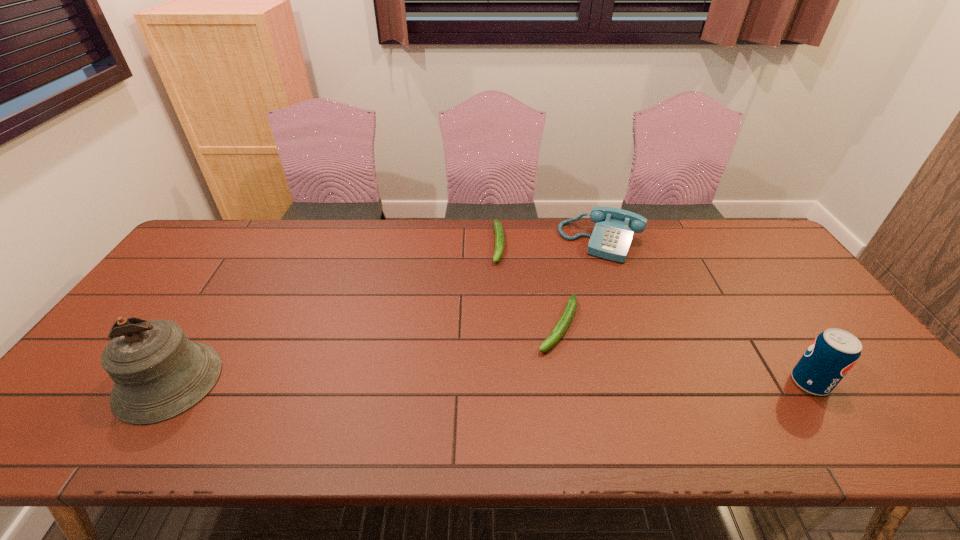
This screenshot has height=540, width=960. What are the coordinates of `vacant area that lies between the leftmost object and the telephone` in the screenshot? It's located at (385, 312).

I want to click on free space that is in between the telephone and the fourth object from right to left, so click(x=549, y=243).

Locate an element on the screen. The width and height of the screenshot is (960, 540). the third closest object to the leftmost object is located at coordinates (611, 238).

Locate which object ranks in proximity to the farther zucchini. Please provide its 2D coordinates. Your answer should be formatted as a tuple, i.e. [(x, y)], where the tuple contains the x and y coordinates of a point satisfying the conditions above.

[(563, 323)]

Where is `vacant space that satisfies the following two spatial constraints: 1. on the back side of the third tallest object; 2. on the left side of the second object from left to right`? vacant space that satisfies the following two spatial constraints: 1. on the back side of the third tallest object; 2. on the left side of the second object from left to right is located at coordinates (498, 242).